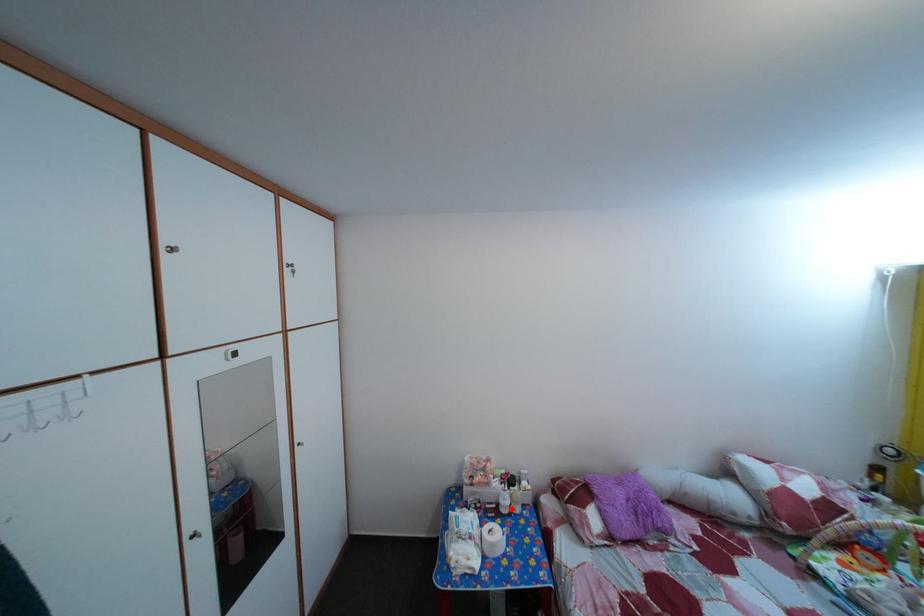
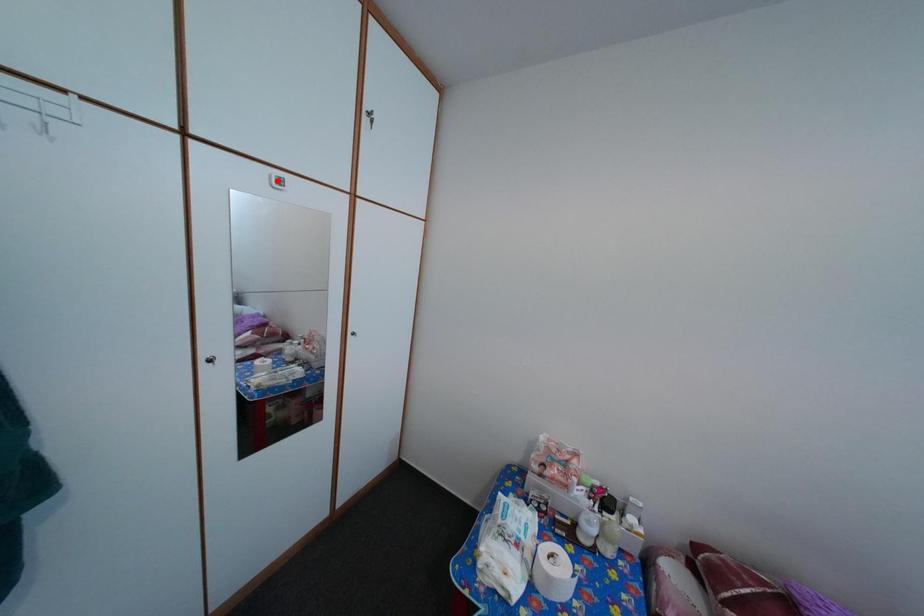
I am providing you with two images of the same scene from different viewpoints. A red point is marked on the first image and another point is marked on the second image. Do the highlighted points in image1 and image2 indicate the same real-world spot?

No